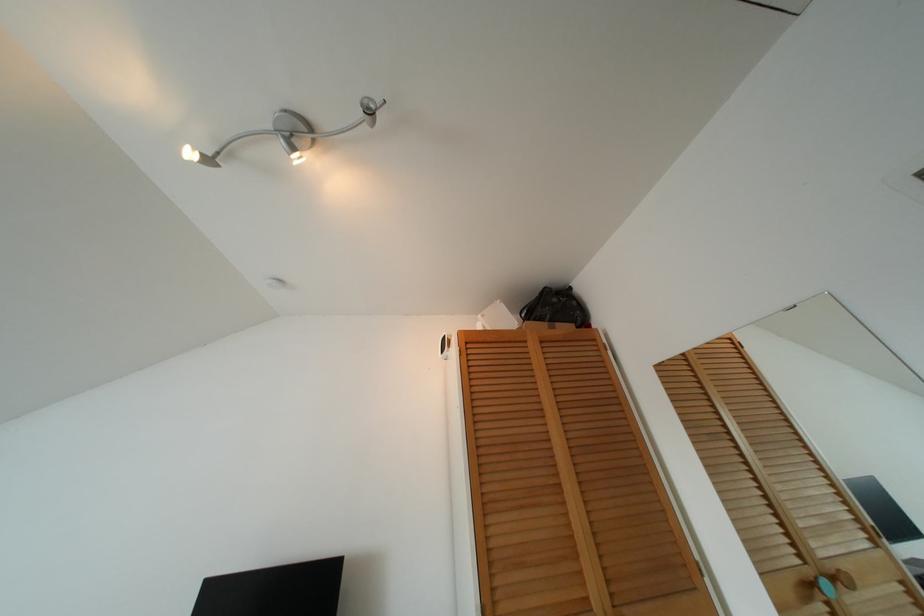
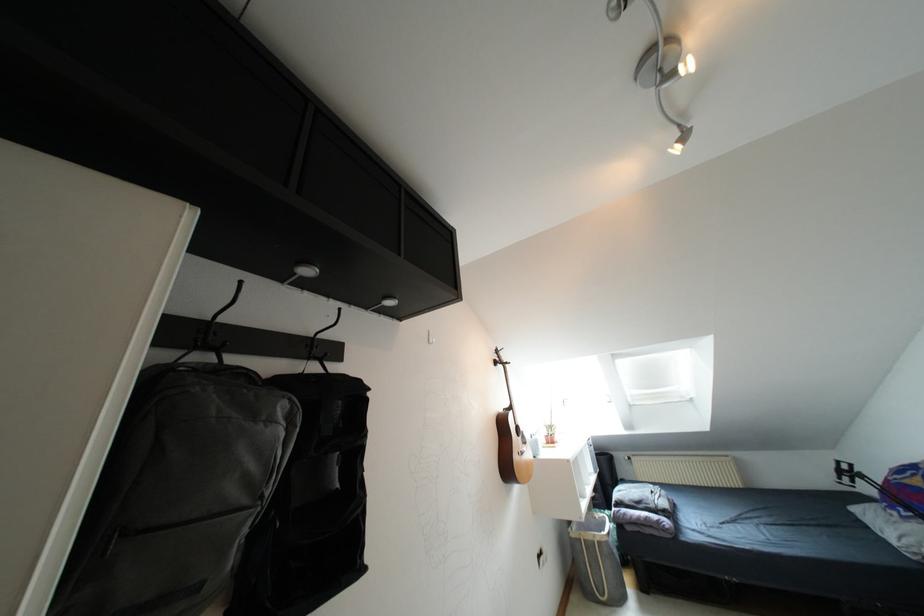
Where in the second image is the point corresponding to point 292,147 from the first image?

(671, 76)